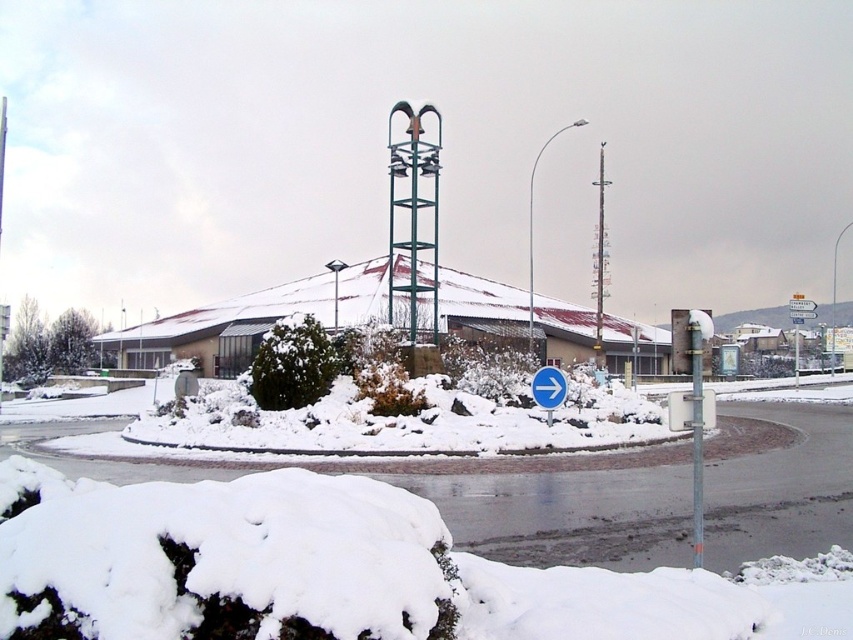
You are a delivery driver approaching the roundabout and see the metallic pole at center and the white plastic arrow at center. Which object is closer to the ground?

The metallic pole at center is closer to the ground because it is positioned below the white plastic arrow at center.

You are standing at the center of the roundabout and looking towards the bell tower. There are two points marked on the snowy ground in front of you. One is at coordinate point(402,173) and the other at point(693,484). Which point is closer to you?

The point at coordinate(402,173) is closer to you because it is further to the viewer than point(693,484).